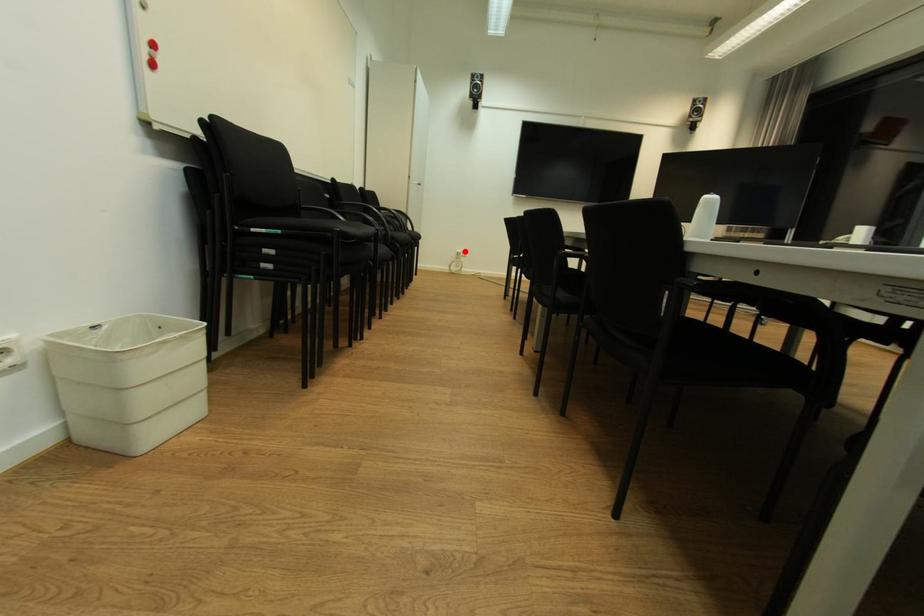
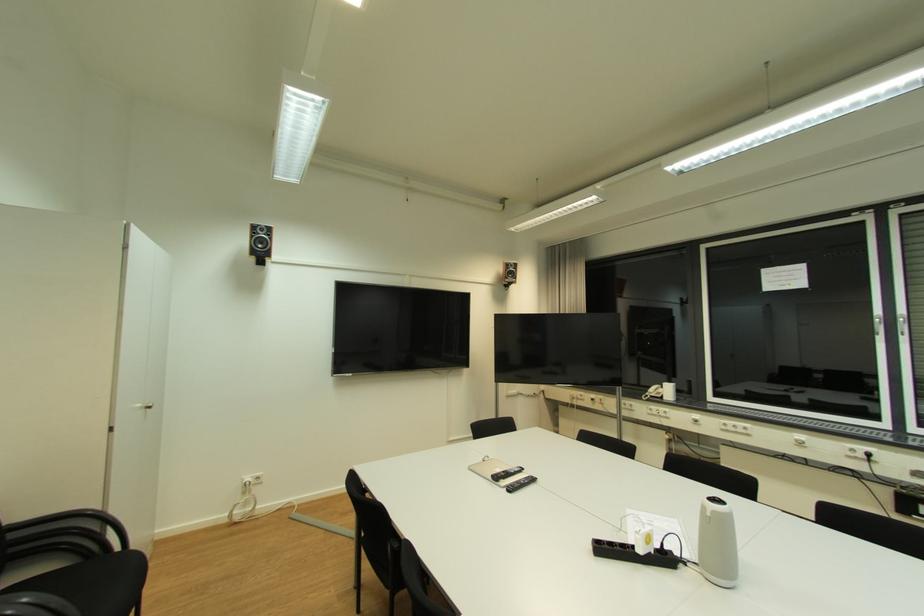
In the second image, find the point that corresponds to the highlighted location in the first image.

(253, 480)